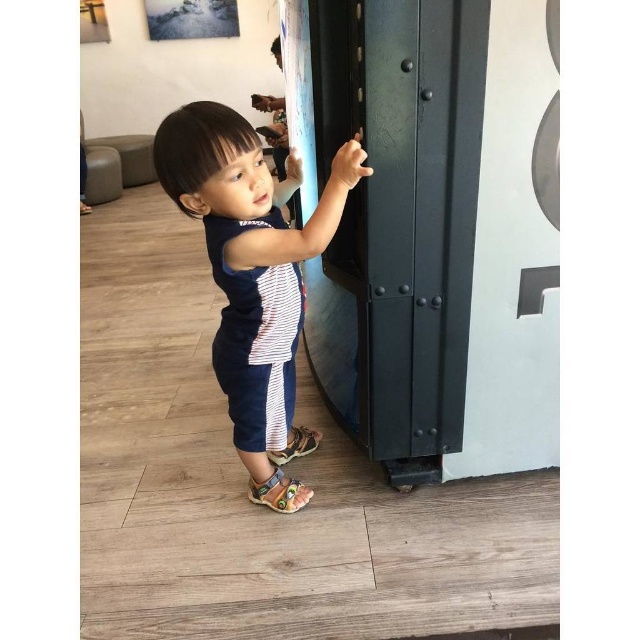
Does blue striped shirt at center appear over brown leather sandal at lower center?

Yes.

How much distance is there between blue striped shirt at center and brown leather sandal at lower center?

The distance of blue striped shirt at center from brown leather sandal at lower center is 14.46 inches.

This screenshot has width=640, height=640. Describe the element at coordinates (250, 259) in the screenshot. I see `blue striped shirt at center` at that location.

Locate an element on the screen. blue striped shirt at center is located at coordinates click(250, 259).

Is white striped shirt at center to the left of multicolored leather sandal at lower center from the viewer's perspective?

Indeed, white striped shirt at center is positioned on the left side of multicolored leather sandal at lower center.

Between point (212, 352) and point (268, 493), which one is positioned in front?

Point (212, 352) is more forward.

Find the location of `white striped shirt at center`. white striped shirt at center is located at coordinates (256, 337).

Can you confirm if blue striped shirt at center is positioned to the left of multicolored leather sandal at lower center?

Indeed, blue striped shirt at center is positioned on the left side of multicolored leather sandal at lower center.

Does point (209, 108) come behind point (268, 506)?

No, (209, 108) is in front of (268, 506).

The width and height of the screenshot is (640, 640). What do you see at coordinates (250, 259) in the screenshot? I see `blue striped shirt at center` at bounding box center [250, 259].

The height and width of the screenshot is (640, 640). Find the location of `blue striped shirt at center`. blue striped shirt at center is located at coordinates (250, 259).